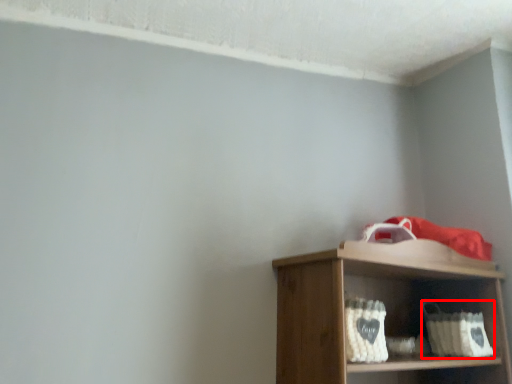
Question: From the image's perspective, what is the correct spatial relationship of basket (annotated by the red box) in relation to basket?

Choices:
 (A) below
 (B) above

Answer: (A)